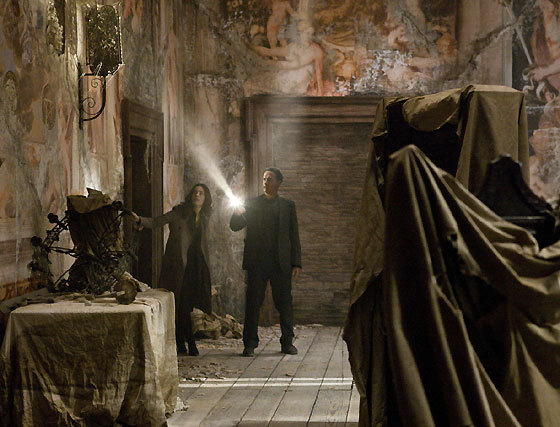
Where is `wooden floorboards`? The width and height of the screenshot is (560, 427). wooden floorboards is located at coordinates [252, 392], [323, 410], [306, 405], [274, 403], [213, 406], [217, 410], [353, 414].